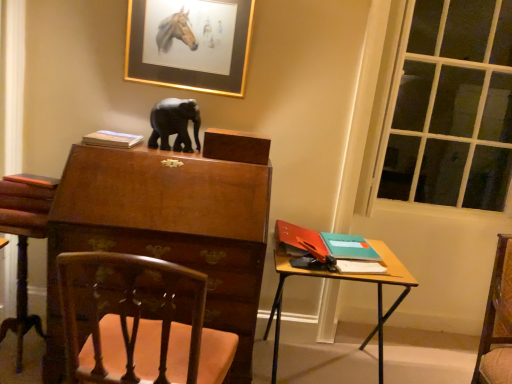
At what (x,y) coordinates should I click in order to perform the action: click on gold-framed picture at upper center. Please return your answer as a coordinate pair (x, y). Looking at the image, I should click on (189, 49).

The image size is (512, 384). What do you see at coordinates (170, 225) in the screenshot?
I see `wooden carved chair at lower left` at bounding box center [170, 225].

You are a GUI agent. You are given a task and a screenshot of the screen. Output one action in this format:
    pyautogui.click(x=<x>, y=<y>)
    Task: Click on the matte paper book at upper left, the 3th book from the bottom
    The width and height of the screenshot is (512, 384).
    Given the screenshot: What is the action you would take?
    pyautogui.click(x=112, y=139)

Locate an element on the screen. transparent glass window at right is located at coordinates (442, 107).

Is gold-framed picture at upper center smaller than matte paper book at upper left, the third book when ordered from right to left?

No.

The image size is (512, 384). What are the coordinates of `picture frame behind the matte paper book at upper left, the first book viewed from the top` in the screenshot? It's located at (189, 49).

Which is correct: gold-framed picture at upper center is inside matte paper book at upper left, the first book viewed from the top, or outside of it?

gold-framed picture at upper center is located beyond the bounds of matte paper book at upper left, the first book viewed from the top.

From a real-world perspective, is gold-framed picture at upper center on matte paper book at upper left, the third book when ordered from right to left?

Indeed, from a real-world perspective, gold-framed picture at upper center stands above matte paper book at upper left, the third book when ordered from right to left.

Which is in front, point (346, 247) or point (307, 252)?

The point (307, 252) is closer.

Which object is wider, teal matte book at right, the first book ordered from the bottom, or orange matte book at right, which is counted as the second book, starting from the bottom?

orange matte book at right, which is counted as the second book, starting from the bottom.

Based on the photo, is teal matte book at right, placed as the 1th book when sorted from right to left, next to orange matte book at right, which ranks as the 2th book in top-to-bottom order, and touching it?

There is a gap between teal matte book at right, placed as the 1th book when sorted from right to left, and orange matte book at right, which ranks as the 2th book in top-to-bottom order.

In the image, is teal matte book at right, the first book ordered from the bottom, positioned in front of or behind orange matte book at right, which is the 2th book in right-to-left order?

teal matte book at right, the first book ordered from the bottom, is positioned farther from the viewer than orange matte book at right, which is the 2th book in right-to-left order.

Can orange matte book at right, which ranks as the 2th book in top-to-bottom order, be found inside wooden carved chair at lower left?

No, orange matte book at right, which ranks as the 2th book in top-to-bottom order, is not a part of wooden carved chair at lower left.

Which is farther, (17, 199) or (296, 228)?

The point (296, 228) is farther.

From the image's perspective, which is above, wooden carved chair at lower left or orange matte book at right, positioned as the 2th book in left-to-right order?

orange matte book at right, positioned as the 2th book in left-to-right order, is shown above in the image.

Relative to orange matte book at right, which ranks as the 2th book in top-to-bottom order, is wooden carved chair at lower left in front or behind?

Visually, wooden carved chair at lower left is located in front of orange matte book at right, which ranks as the 2th book in top-to-bottom order.

Does point (165, 5) come behind point (390, 283)?

That is True.

Is gold-framed picture at upper center in contact with wooden desk at right?

No.

Considering their positions, is gold-framed picture at upper center located in front of or behind wooden desk at right?

gold-framed picture at upper center is positioned farther from the viewer than wooden desk at right.

Would you say matte paper book at upper left, the first book viewed from the top, is part of wooden carved chair at lower left's contents?

No, matte paper book at upper left, the first book viewed from the top, is located outside of wooden carved chair at lower left.

Measure the distance between wooden carved chair at lower left and matte paper book at upper left, the 1th book when ordered from left to right.

wooden carved chair at lower left and matte paper book at upper left, the 1th book when ordered from left to right, are 19.60 inches apart.

What's the angular difference between wooden carved chair at lower left and matte paper book at upper left, the 3th book from the bottom,'s facing directions?

168 degrees.

From the image's perspective, is wooden carved chair at lower left positioned above or below matte paper book at upper left, the third book when ordered from right to left?

From the image's perspective, wooden carved chair at lower left appears below matte paper book at upper left, the third book when ordered from right to left.

Can you confirm if wooden desk at right is taller than gold-framed picture at upper center?

Indeed, wooden desk at right has a greater height compared to gold-framed picture at upper center.

Can you confirm if wooden desk at right is positioned to the right of gold-framed picture at upper center?

Indeed, wooden desk at right is positioned on the right side of gold-framed picture at upper center.

Which is behind, wooden desk at right or gold-framed picture at upper center?

gold-framed picture at upper center is further away from the camera.

Could you tell me if wooden desk at right is turned towards gold-framed picture at upper center?

No, wooden desk at right does not turn towards gold-framed picture at upper center.

Can you confirm if wooden carved chair at lower left is shorter than gold-framed picture at upper center?

No, wooden carved chair at lower left is not shorter than gold-framed picture at upper center.

Is wooden carved chair at lower left wider or thinner than gold-framed picture at upper center?

wooden carved chair at lower left is wider than gold-framed picture at upper center.

Is wooden carved chair at lower left closer to camera compared to gold-framed picture at upper center?

Yes, wooden carved chair at lower left is closer to the camera.

Looking at this image, from the image's perspective, between wooden carved chair at lower left and gold-framed picture at upper center, who is located below?

wooden carved chair at lower left appears lower in the image.

There is a gold-framed picture at upper center. Identify the location of the 1st book below it (from a real-world perspective). (112, 139).

Where is `the 1st book above the teal matte book at right, the 3th book from the left (from the image's perspective)`? This screenshot has width=512, height=384. the 1st book above the teal matte book at right, the 3th book from the left (from the image's perspective) is located at coordinates (301, 240).

From the image, which object appears to be farther from matte paper book at upper left, the first book viewed from the top, transparent glass window at right or black glossy elephant at upper center?

transparent glass window at right lies further to matte paper book at upper left, the first book viewed from the top, than the other object.

Estimate the real-world distances between objects in this image. Which object is closer to wooden carved chair at lower left, wooden carved chair at lower left or matte paper book at upper left, the 3th book from the bottom?

wooden carved chair at lower left is closer to wooden carved chair at lower left.

Estimate the real-world distances between objects in this image. Which object is closer to wooden carved chair at lower left, matte paper book at upper left, the 1th book when ordered from left to right, or teal matte book at right, placed as the 1th book when sorted from right to left?

The object closer to wooden carved chair at lower left is matte paper book at upper left, the 1th book when ordered from left to right.

Which object lies nearer to the anchor point matte paper book at upper left, the third book when ordered from right to left, gold-framed picture at upper center or wooden carved chair at lower left?

The object closer to matte paper book at upper left, the third book when ordered from right to left, is gold-framed picture at upper center.

From the image, which object appears to be nearer to gold-framed picture at upper center, teal matte book at right, placed as the 3th book when sorted from top to bottom, or transparent glass window at right?

teal matte book at right, placed as the 3th book when sorted from top to bottom, lies closer to gold-framed picture at upper center than the other object.

When comparing their distances from orange matte book at right, which ranks as the 2th book in top-to-bottom order, does wooden carved chair at lower left or matte paper book at upper left, the third book when ordered from right to left, seem closer?

wooden carved chair at lower left lies closer to orange matte book at right, which ranks as the 2th book in top-to-bottom order, than the other object.

From the image, which object appears to be nearer to transparent glass window at right, black glossy elephant at upper center or teal matte book at right, placed as the 1th book when sorted from right to left?

teal matte book at right, placed as the 1th book when sorted from right to left.

Considering their positions, is wooden carved chair at lower left positioned closer to matte paper book at upper left, the 3th book from the bottom, than gold-framed picture at upper center?

wooden carved chair at lower left.

Image resolution: width=512 pixels, height=384 pixels. Find the location of `elephant situated between wooden carved chair at lower left and teal matte book at right, placed as the 3th book when sorted from top to bottom, from left to right`. elephant situated between wooden carved chair at lower left and teal matte book at right, placed as the 3th book when sorted from top to bottom, from left to right is located at coordinates (174, 124).

Locate an element on the screen. This screenshot has height=384, width=512. desk between matte paper book at upper left, the 1th book when ordered from left to right, and transparent glass window at right is located at coordinates (337, 281).

What are the coordinates of `desk between gold-framed picture at upper center and transparent glass window at right` in the screenshot? It's located at (337, 281).

Find the location of a particular element. book between gold-framed picture at upper center and orange matte book at right, which is counted as the second book, starting from the bottom, in the up-down direction is located at coordinates (112, 139).